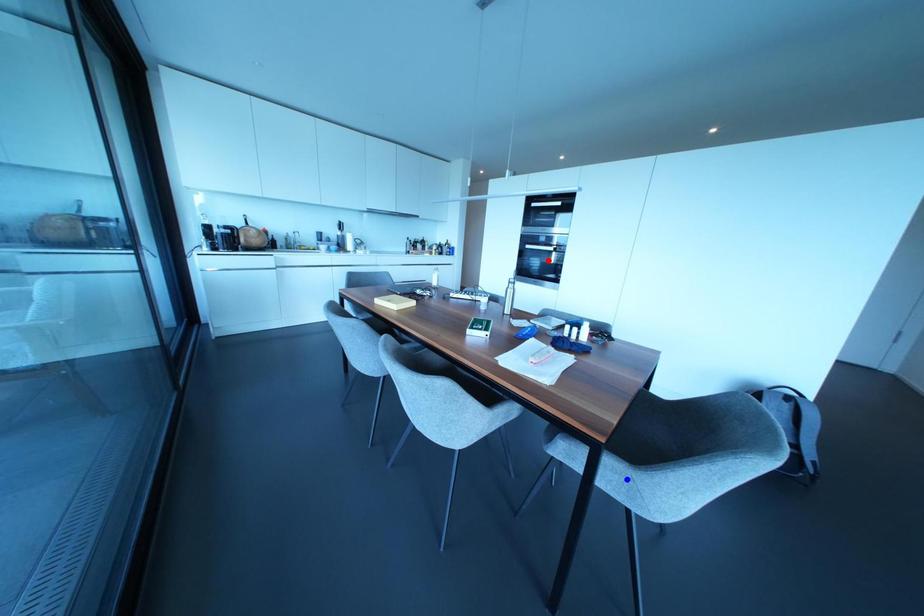
Question: In the image, two points are highlighted. Which point is nearer to the camera? Reply with the corresponding letter.

Choices:
 (A) blue point
 (B) red point

Answer: (A)